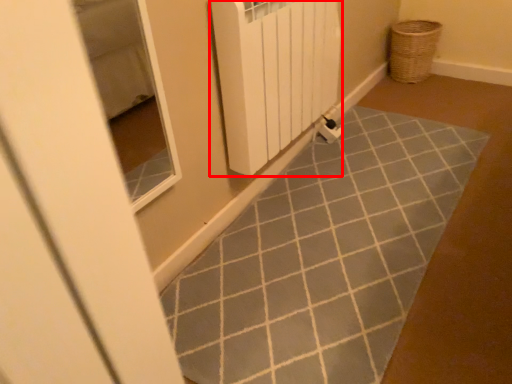
Question: Where is radiator (annotated by the red box) located in relation to basket in the image?

Choices:
 (A) right
 (B) left

Answer: (B)